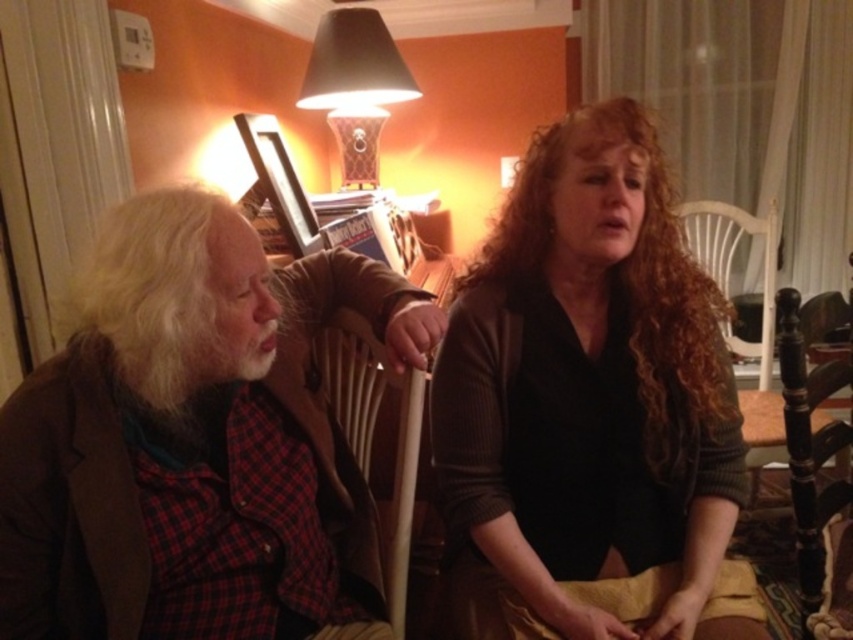
You are a tailor who needs to determine which item between the dark brown sweater at center and the matte black lampshade at upper center requires a larger piece of fabric for its base material. Based on the scene, which one would you prioritize?

Result: The dark brown sweater at center requires a larger piece of fabric since its width surpasses that of the matte black lampshade at upper center.

You are a guest entering the living room and see the dark brown sweater at center and the wooden chair at center. Which object is closer to you?

The dark brown sweater at center is closer to you because it is in front of the wooden chair at center.